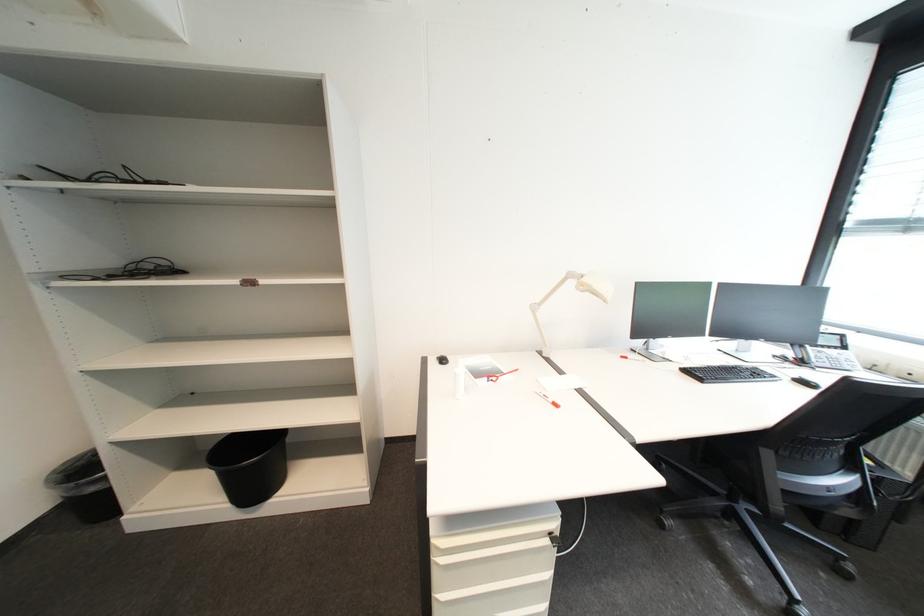
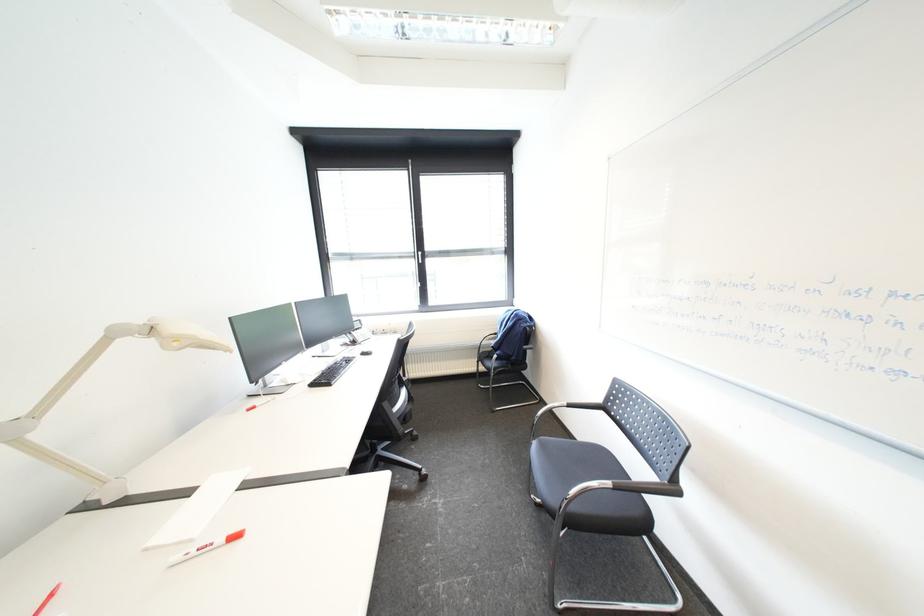
Question: The first image is from the beginning of the video and the second image is from the end. How did the camera likely rotate when shooting the video?

Choices:
 (A) Left
 (B) Right
 (C) Up
 (D) Down

Answer: (B)